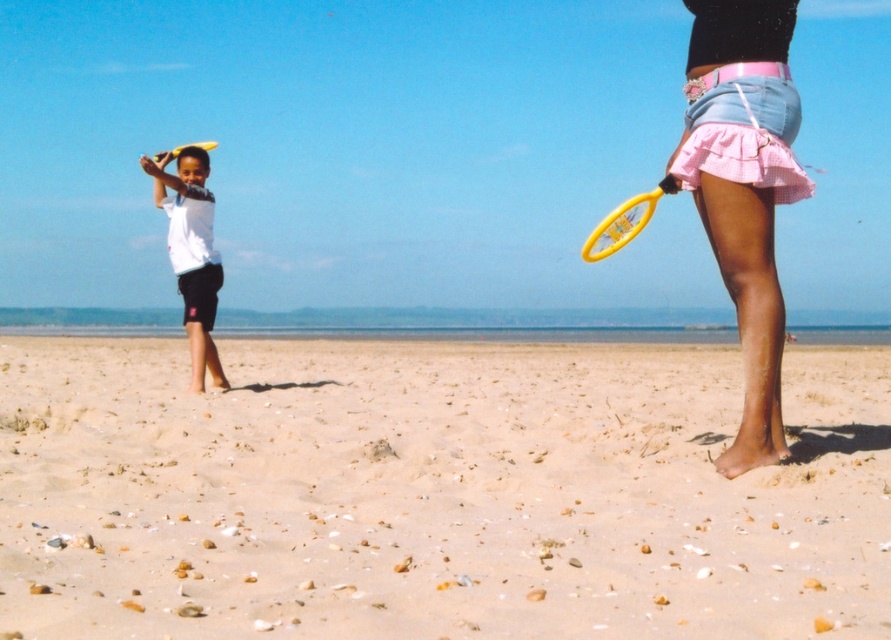
Question: Considering the real-world distances, which object is farthest from the yellow plastic tennis racket at right?

Choices:
 (A) white matte shirt at left
 (B) fine-grained sand at lower center

Answer: (A)

Question: Is fine-grained sand at lower center closer to the viewer compared to pink denim skirt at right?

Choices:
 (A) no
 (B) yes

Answer: (B)

Question: Which object is farther from the camera taking this photo?

Choices:
 (A) white matte shirt at left
 (B) pink denim skirt at right
 (C) yellow plastic frisbee at left
 (D) yellow plastic tennis racket at right

Answer: (C)

Question: Which is farther from the yellow plastic tennis racket at right?

Choices:
 (A) pink denim skirt at right
 (B) fine-grained sand at lower center

Answer: (A)

Question: Observing the image, what is the correct spatial positioning of pink denim skirt at right in reference to white matte shirt at left?

Choices:
 (A) below
 (B) above

Answer: (A)

Question: Can you confirm if fine-grained sand at lower center is bigger than white matte shirt at left?

Choices:
 (A) no
 (B) yes

Answer: (B)